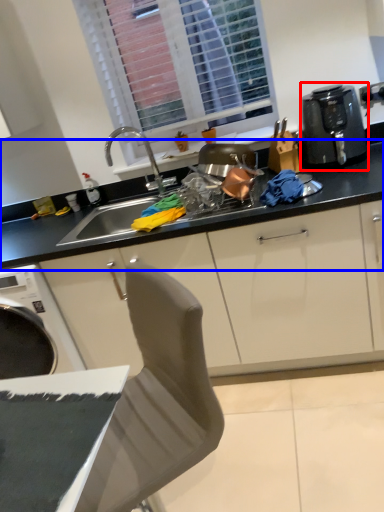
Question: Among these objects, which one is farthest to the camera, kitchen appliance (highlighted by a red box) or countertop (highlighted by a blue box)?

Choices:
 (A) kitchen appliance
 (B) countertop

Answer: (B)